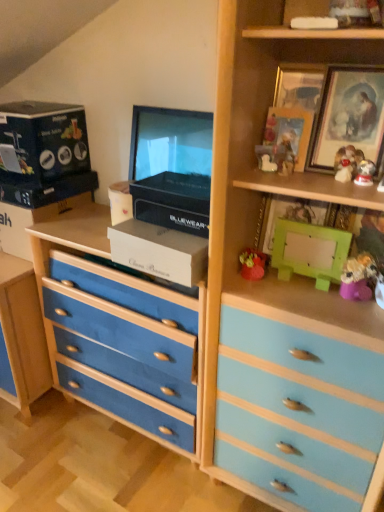
Question: Can you confirm if fuzzy yellow toy at right, the fourth toy from the left, is positioned to the left of white cardboard box at center, the 3th box viewed from the left?

Choices:
 (A) no
 (B) yes

Answer: (A)

Question: Does fuzzy yellow toy at right, positioned as the first toy in right-to-left order, have a greater height compared to white cardboard box at center, the third box in the right-to-left sequence?

Choices:
 (A) no
 (B) yes

Answer: (B)

Question: Considering the relative sizes of fuzzy yellow toy at right, positioned as the first toy in right-to-left order, and white cardboard box at center, the third box in the right-to-left sequence, in the image provided, is fuzzy yellow toy at right, positioned as the first toy in right-to-left order, smaller than white cardboard box at center, the third box in the right-to-left sequence,?

Choices:
 (A) no
 (B) yes

Answer: (B)

Question: Does fuzzy yellow toy at right, placed as the fourth toy when sorted from top to bottom, lie in front of white cardboard box at center, the third box in the right-to-left sequence?

Choices:
 (A) yes
 (B) no

Answer: (A)

Question: Is fuzzy yellow toy at right, acting as the first toy starting from the bottom, far from white cardboard box at center, the 3th box viewed from the left?

Choices:
 (A) no
 (B) yes

Answer: (A)

Question: Can you confirm if fuzzy yellow toy at right, positioned as the first toy in right-to-left order, is shorter than white cardboard box at center, the third box in the right-to-left sequence?

Choices:
 (A) no
 (B) yes

Answer: (A)

Question: Does matte cardboard box at upper left, which is the 1th box from left to right, have a lesser height compared to green matte box at upper right, which is counted as the first box, starting from the right?

Choices:
 (A) no
 (B) yes

Answer: (A)

Question: Is matte cardboard box at upper left, which is the fifth box in right-to-left order, in contact with green matte box at upper right, which is counted as the first box, starting from the right?

Choices:
 (A) no
 (B) yes

Answer: (A)

Question: Considering the relative sizes of matte cardboard box at upper left, which is the fifth box in right-to-left order, and green matte box at upper right, which is counted as the fifth box, starting from the left, in the image provided, is matte cardboard box at upper left, which is the fifth box in right-to-left order, smaller than green matte box at upper right, which is counted as the fifth box, starting from the left,?

Choices:
 (A) no
 (B) yes

Answer: (A)

Question: From the image's perspective, is matte cardboard box at upper left, which is the fifth box in right-to-left order, below green matte box at upper right, which is counted as the first box, starting from the right?

Choices:
 (A) no
 (B) yes

Answer: (A)

Question: Considering the relative sizes of matte cardboard box at upper left, which is the fifth box in right-to-left order, and green matte box at upper right, which is counted as the first box, starting from the right, in the image provided, is matte cardboard box at upper left, which is the fifth box in right-to-left order, wider than green matte box at upper right, which is counted as the first box, starting from the right,?

Choices:
 (A) yes
 (B) no

Answer: (A)

Question: Considering the relative positions of matte cardboard box at upper left, which is the fifth box in right-to-left order, and green matte box at upper right, which is counted as the first box, starting from the right, in the image provided, is matte cardboard box at upper left, which is the fifth box in right-to-left order, behind green matte box at upper right, which is counted as the first box, starting from the right,?

Choices:
 (A) no
 (B) yes

Answer: (B)

Question: Would you say green matte box at upper right, which is counted as the first box, starting from the right, is part of matte black box at upper left, arranged as the second box when viewed from the left,'s contents?

Choices:
 (A) yes
 (B) no

Answer: (B)